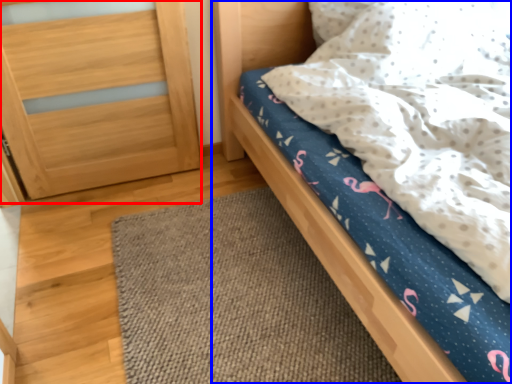
Question: Which object is closer to the camera taking this photo, balustrade (highlighted by a red box) or bed (highlighted by a blue box)?

Choices:
 (A) balustrade
 (B) bed

Answer: (B)